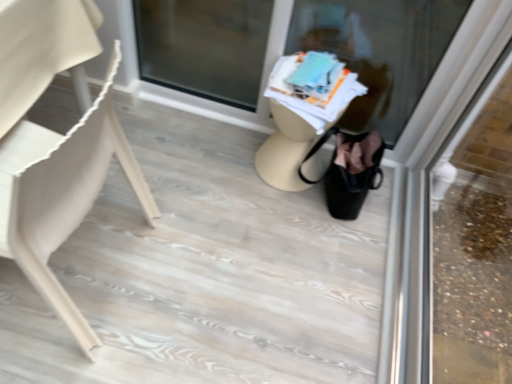
Identify the location of space that is in front of beige matte table at center. (276, 212).